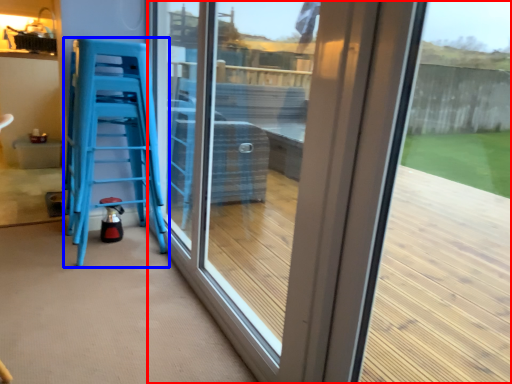
Question: Among these objects, which one is farthest to the camera, window (highlighted by a red box) or furniture (highlighted by a blue box)?

Choices:
 (A) window
 (B) furniture

Answer: (B)